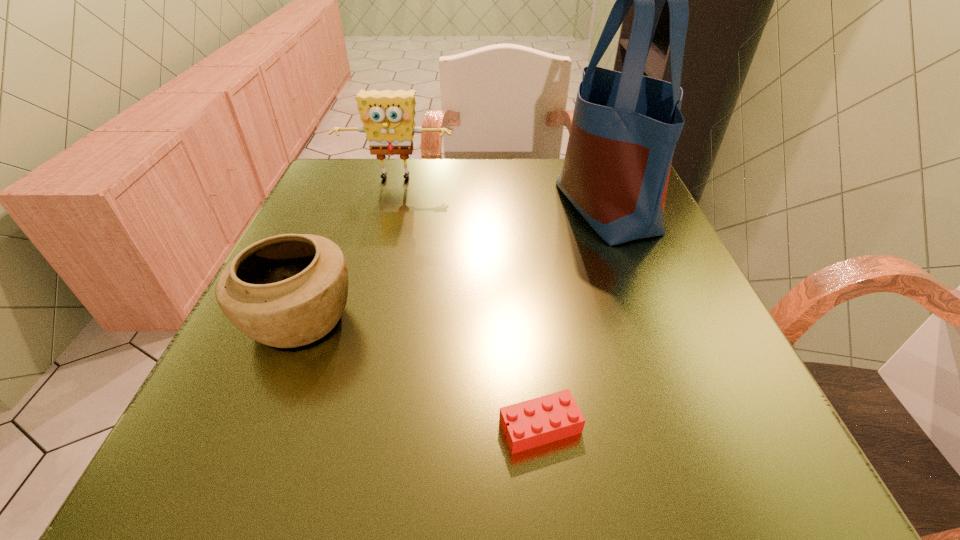
This screenshot has height=540, width=960. Identify the location of the rightmost object. (625, 126).

Where is `handbag`? This screenshot has height=540, width=960. handbag is located at coordinates tap(625, 126).

Image resolution: width=960 pixels, height=540 pixels. Find the location of `the second tallest object`. the second tallest object is located at coordinates (388, 116).

Find the location of a particular element. The height and width of the screenshot is (540, 960). the second nearest object is located at coordinates (285, 291).

At what (x,y) coordinates should I click in order to perform the action: click on the second shortest object. Please return your answer as a coordinate pair (x, y). The height and width of the screenshot is (540, 960). Looking at the image, I should click on (285, 291).

Find the location of `Lego`. Lego is located at coordinates (535, 422).

This screenshot has width=960, height=540. Identify the location of the third object from left to right. (535, 422).

Find the location of a particular element. Image resolution: width=960 pixels, height=540 pixels. free space located 0.370m on the front of the handbag is located at coordinates (687, 421).

Identify the location of free location located 0.060m on the face of the sponge. (390, 202).

This screenshot has width=960, height=540. I want to click on vacant area situated 0.100m on the right of the pottery, so click(418, 319).